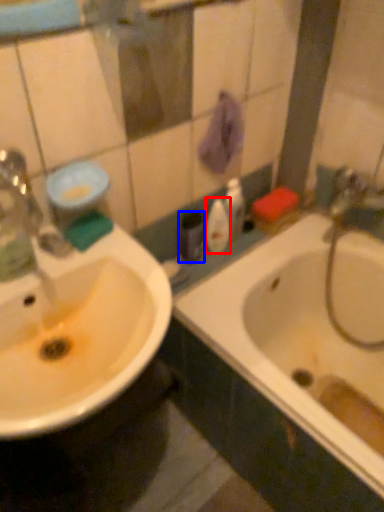
Question: Which object appears farthest to the camera in this image, mouthwash (highlighted by a red box) or toiletry (highlighted by a blue box)?

Choices:
 (A) mouthwash
 (B) toiletry

Answer: (A)